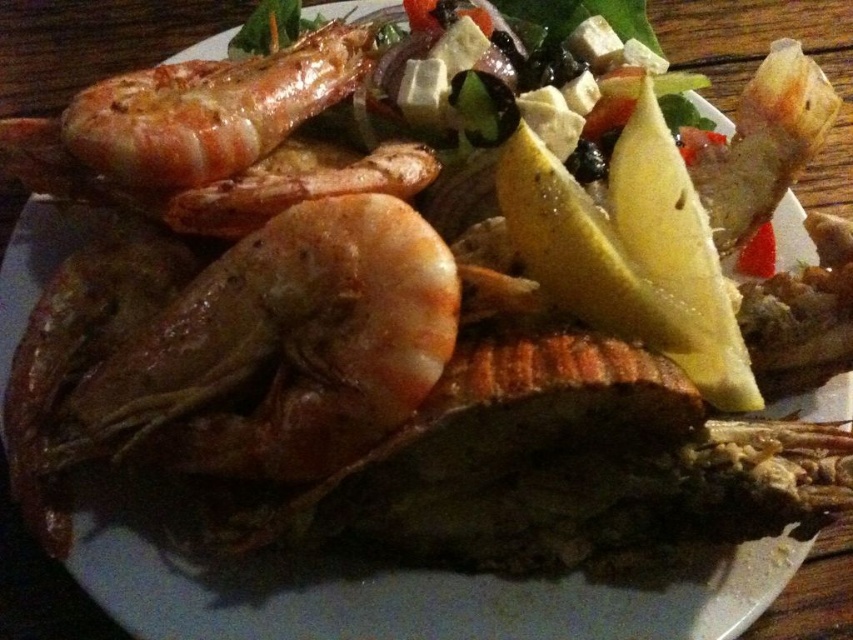
You are a food critic analyzing the arrangement of shrimp on the plate. Which shrimp is positioned to the left of the other between the shiny brown shrimp at center and the golden brown fried shrimp at center?

The shiny brown shrimp at center is positioned to the left of the golden brown fried shrimp at center.

You are a food critic evaluating the arrangement of shrimp on the plate. Which shrimp, the shiny brown shrimp at center or the glossy orange shrimp at upper left, is located to the right of the other?

The shiny brown shrimp at center is positioned on the right side of the glossy orange shrimp at upper left.

You are a food critic evaluating the presentation of this dish. Which item, the fresh green salad at upper center or the golden brown fried shrimp at center, has a taller appearance?

The fresh green salad at upper center has a greater height compared to the golden brown fried shrimp at center, so it appears taller.